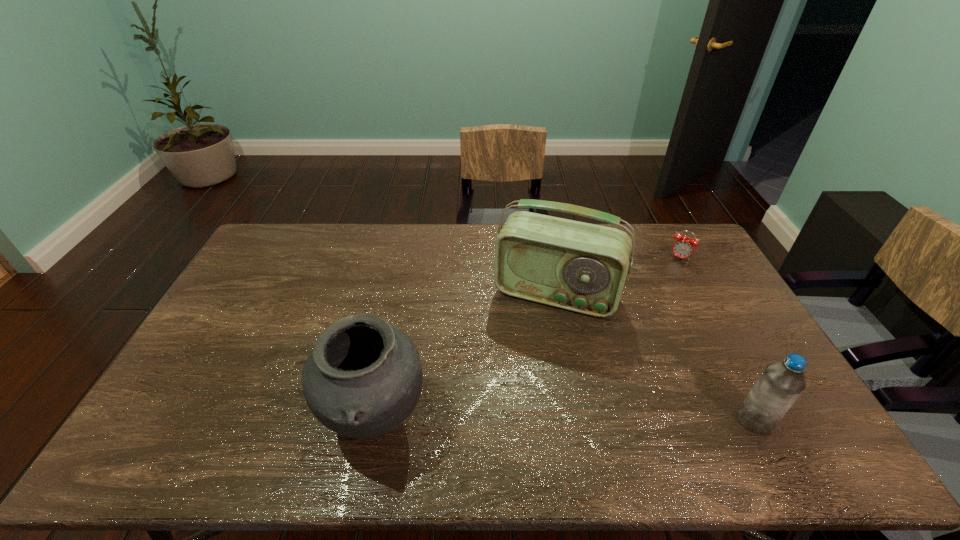
Identify the location of object that is at the far right corner. The height and width of the screenshot is (540, 960). (683, 247).

Find the location of a particular element. This screenshot has width=960, height=540. object located at the near right corner is located at coordinates (781, 383).

The height and width of the screenshot is (540, 960). What are the coordinates of `vacant space at the far edge of the desktop` in the screenshot? It's located at (419, 259).

You are a GUI agent. You are given a task and a screenshot of the screen. Output one action in this format:
    pyautogui.click(x=<x>, y=<y>)
    Task: Click on the vacant space at the left edge of the desktop
    The width and height of the screenshot is (960, 540).
    Given the screenshot: What is the action you would take?
    pyautogui.click(x=204, y=360)

At what (x,y) coordinates should I click in order to perform the action: click on vacant space at the right edge of the desktop. Please return your answer as a coordinate pair (x, y). This screenshot has height=540, width=960. Looking at the image, I should click on (737, 359).

The width and height of the screenshot is (960, 540). I want to click on vacant area that lies between the urn and the third tallest object, so (x=565, y=420).

Where is `unoccupied area between the second shortest object and the leftmost object`? The image size is (960, 540). unoccupied area between the second shortest object and the leftmost object is located at coordinates (565, 420).

Where is `empty location between the third shortest object and the third tallest object`? The image size is (960, 540). empty location between the third shortest object and the third tallest object is located at coordinates (565, 420).

Find the location of `empty space between the urn and the farthest object`. empty space between the urn and the farthest object is located at coordinates tap(528, 339).

The width and height of the screenshot is (960, 540). In order to click on vacant space that's between the farthest object and the water bottle in this screenshot , I will do `click(717, 339)`.